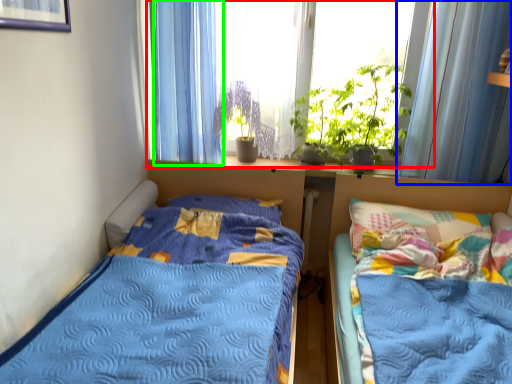
Question: Which is farther away from window (highlighted by a red box)? curtain (highlighted by a blue box) or curtain (highlighted by a green box)?

Choices:
 (A) curtain
 (B) curtain

Answer: (A)